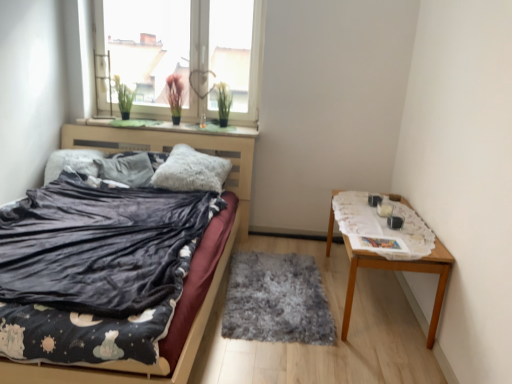
Question: Does fuzzy gray rug at center have a lesser width compared to fluffy gray pillow at center, acting as the 2th pillow starting from the left?

Choices:
 (A) yes
 (B) no

Answer: (B)

Question: Considering the relative sizes of fuzzy gray rug at center and fluffy gray pillow at center, which is counted as the first pillow, starting from the right, in the image provided, is fuzzy gray rug at center wider than fluffy gray pillow at center, which is counted as the first pillow, starting from the right,?

Choices:
 (A) no
 (B) yes

Answer: (B)

Question: Are fuzzy gray rug at center and fluffy gray pillow at center, acting as the 2th pillow starting from the left, far apart?

Choices:
 (A) yes
 (B) no

Answer: (B)

Question: Would you say fuzzy gray rug at center contains fluffy gray pillow at center, which is counted as the first pillow, starting from the right?

Choices:
 (A) yes
 (B) no

Answer: (B)

Question: From the image's perspective, would you say fuzzy gray rug at center is positioned over fluffy gray pillow at center, which is counted as the first pillow, starting from the right?

Choices:
 (A) no
 (B) yes

Answer: (A)

Question: In terms of width, does white lace tablecloth at right look wider or thinner when compared to transparent glass window at upper center?

Choices:
 (A) thin
 (B) wide

Answer: (B)

Question: In the image, is white lace tablecloth at right positioned in front of or behind transparent glass window at upper center?

Choices:
 (A) front
 (B) behind

Answer: (A)

Question: Would you say white lace tablecloth at right is inside or outside transparent glass window at upper center?

Choices:
 (A) outside
 (B) inside

Answer: (A)

Question: From a real-world perspective, is white lace tablecloth at right above or below transparent glass window at upper center?

Choices:
 (A) above
 (B) below

Answer: (B)

Question: Visually, is wooden table at right positioned to the left or to the right of white lace tablecloth at right?

Choices:
 (A) left
 (B) right

Answer: (B)

Question: From the image's perspective, relative to white lace tablecloth at right, is wooden table at right above or below?

Choices:
 (A) below
 (B) above

Answer: (A)

Question: Based on their sizes in the image, would you say wooden table at right is bigger or smaller than white lace tablecloth at right?

Choices:
 (A) small
 (B) big

Answer: (B)

Question: Is wooden table at right wider or thinner than white lace tablecloth at right?

Choices:
 (A) thin
 (B) wide

Answer: (A)

Question: From a real-world perspective, is transparent glass window at upper center above or below white lace tablecloth at right?

Choices:
 (A) below
 (B) above

Answer: (B)

Question: Choose the correct answer: Is transparent glass window at upper center inside white lace tablecloth at right or outside it?

Choices:
 (A) inside
 (B) outside

Answer: (B)